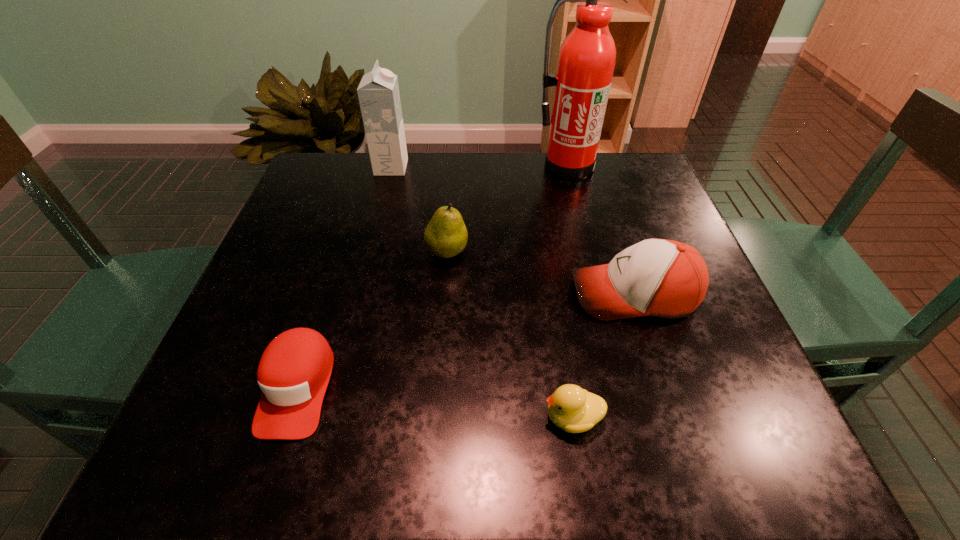
Identify the location of duckling that is at the near edge. This screenshot has width=960, height=540. (573, 409).

Where is `baseball cap that is at the near edge`? baseball cap that is at the near edge is located at coordinates (294, 371).

This screenshot has height=540, width=960. I want to click on object that is at the left edge, so click(x=294, y=371).

What are the coordinates of `fire extinguisher located at the right edge` in the screenshot? It's located at (586, 61).

Image resolution: width=960 pixels, height=540 pixels. In order to click on baseball cap located at the right edge in this screenshot , I will do `click(663, 278)`.

Image resolution: width=960 pixels, height=540 pixels. I want to click on object positioned at the near left corner, so click(x=294, y=371).

Locate an element on the screen. Image resolution: width=960 pixels, height=540 pixels. object at the far right corner is located at coordinates (586, 61).

I want to click on vacant space at the far edge of the desktop, so click(x=579, y=194).

Locate an element on the screen. The height and width of the screenshot is (540, 960). free space at the near edge is located at coordinates (596, 433).

This screenshot has width=960, height=540. Find the location of `free region at the left edge`. free region at the left edge is located at coordinates (290, 210).